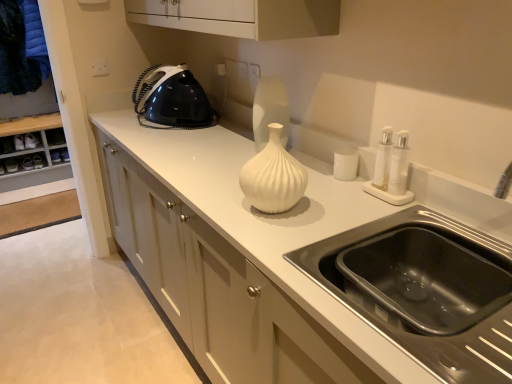
Where is `vacant space to the right of white matte vase at center`? The width and height of the screenshot is (512, 384). vacant space to the right of white matte vase at center is located at coordinates (334, 204).